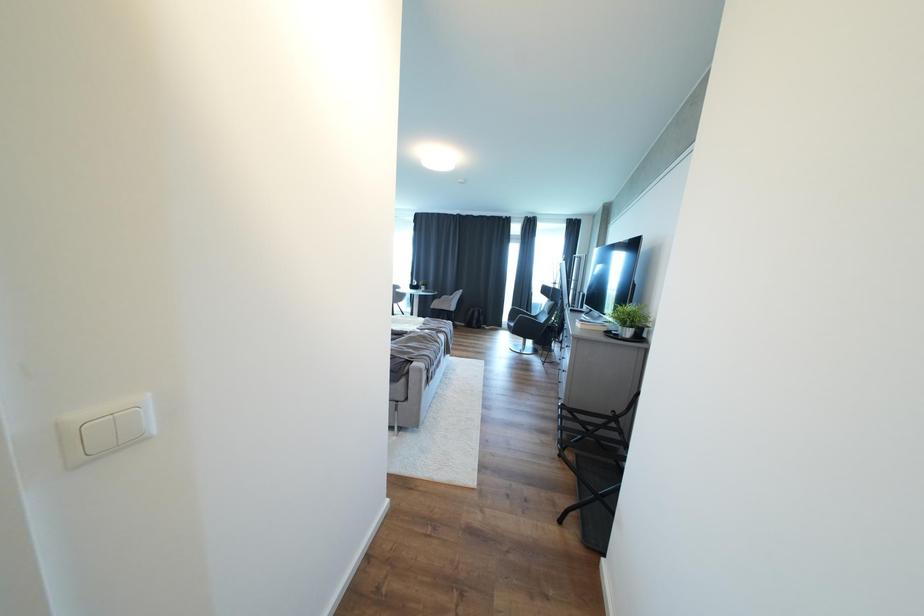
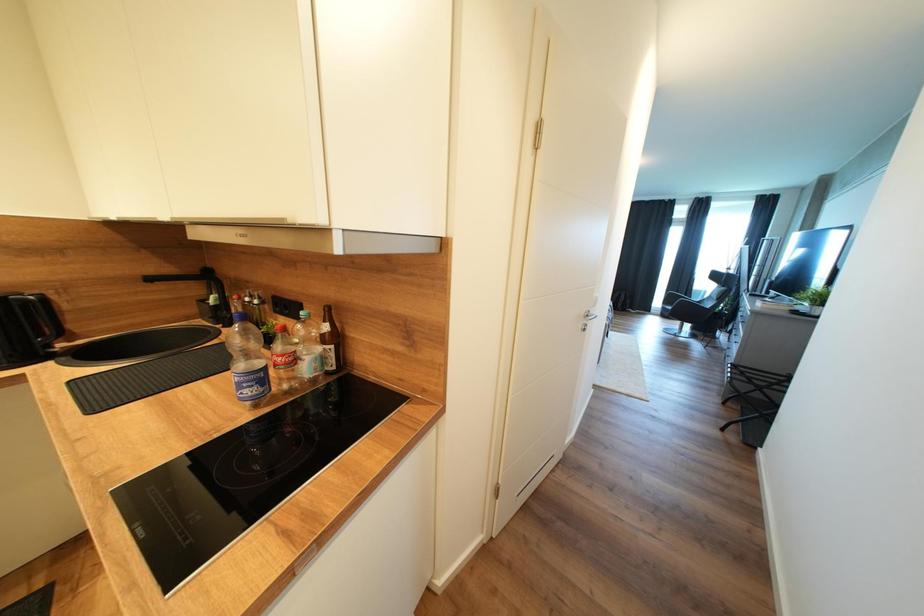
The images are taken continuously from a first-person perspective. In which direction are you moving?

The movement direction of the cameraman is left, backward.